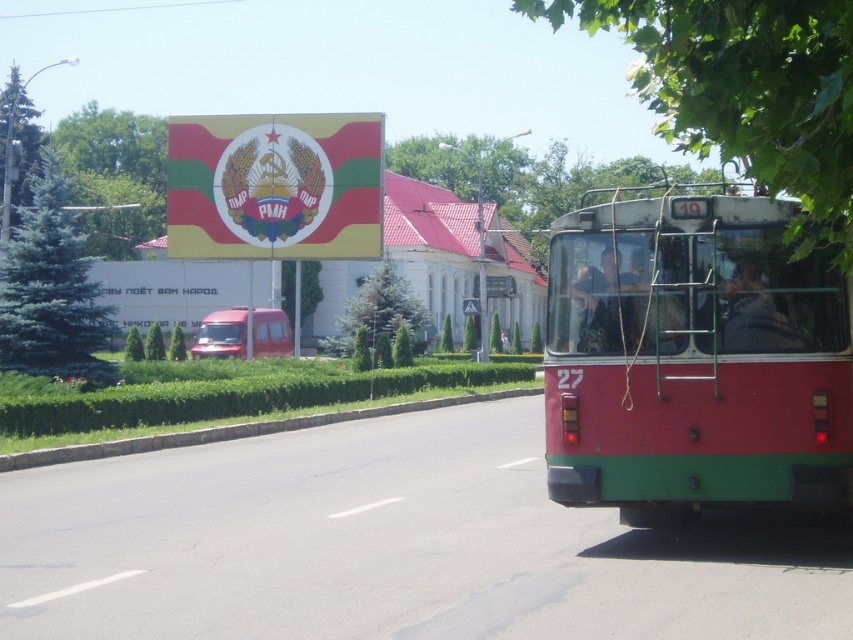
Question: Which point is closer to the camera?

Choices:
 (A) (280, 356)
 (B) (575, 253)

Answer: (B)

Question: Which object appears closest to the camera in this image?

Choices:
 (A) metallic red van at center
 (B) matte red bus at right

Answer: (B)

Question: Is matte red bus at right wider than metallic red van at center?

Choices:
 (A) yes
 (B) no

Answer: (B)

Question: Is matte red bus at right thinner than metallic red van at center?

Choices:
 (A) yes
 (B) no

Answer: (A)

Question: Is matte red bus at right to the left of metallic red van at center from the viewer's perspective?

Choices:
 (A) yes
 (B) no

Answer: (B)